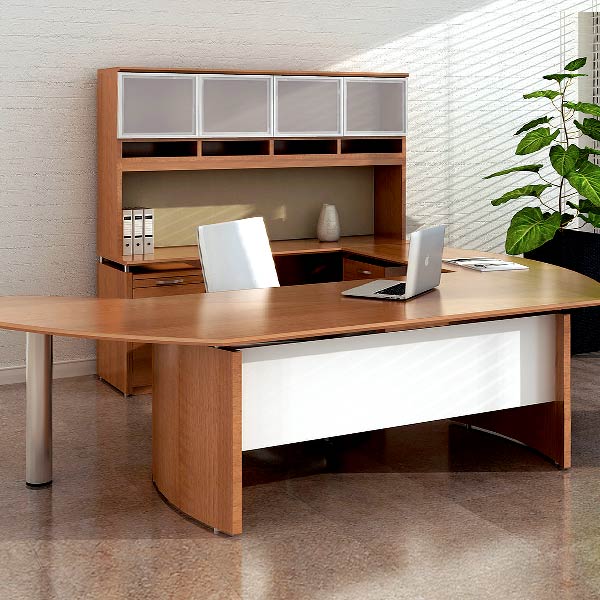
Find any where you'd open the drawer in the picture. Your answer should be formatted as a list of tuples, i.e. [(x1, y1), (x2, y2), ...], where each tuple contains the x and y coordinates of a point satisfying the conditions above.

[(370, 272)]